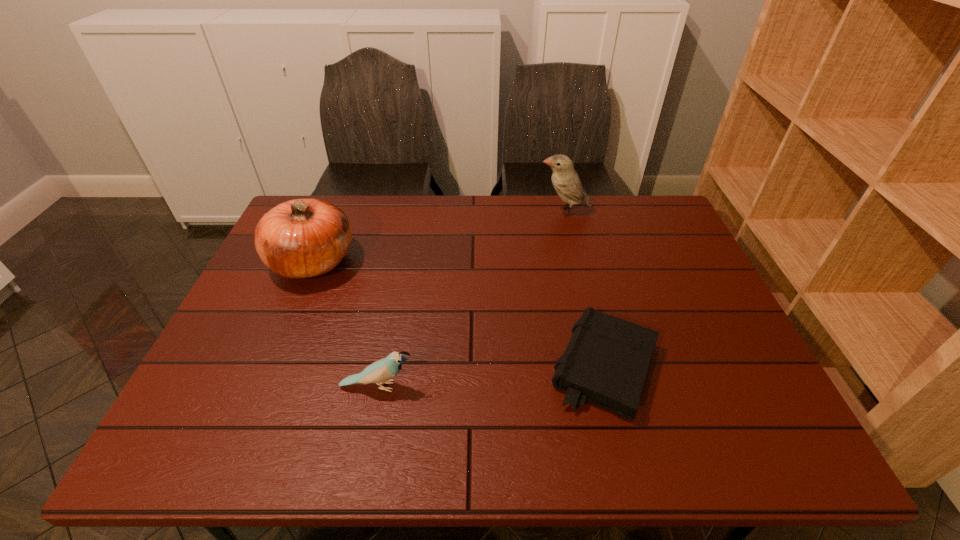
At what (x,y) coordinates should I click in order to perform the action: click on vacant space located 0.170m on the front of the third nearest object. Please return your answer as a coordinate pair (x, y). This screenshot has width=960, height=540. Looking at the image, I should click on (278, 343).

Image resolution: width=960 pixels, height=540 pixels. Identify the location of blank area located at the face of the nearer bird. tap(554, 387).

Identify the location of free space located 0.150m on the left of the shortest object. This screenshot has width=960, height=540. (483, 367).

Where is `bird at the far edge`? The image size is (960, 540). bird at the far edge is located at coordinates (565, 180).

Where is `pumpkin located at the far edge`? The image size is (960, 540). pumpkin located at the far edge is located at coordinates (301, 238).

Identify the location of object that is at the near edge. The image size is (960, 540). (605, 363).

Find the location of a particular element. The width and height of the screenshot is (960, 540). object located at the left edge is located at coordinates (301, 238).

At what (x,y) coordinates should I click in order to perform the action: click on object present at the far left corner. Please return your answer as a coordinate pair (x, y). Looking at the image, I should click on (301, 238).

Image resolution: width=960 pixels, height=540 pixels. What are the coordinates of `vacant position at the far edge of the desktop` in the screenshot? It's located at (500, 203).

In order to click on free region at the near edge of the desktop in this screenshot , I will do `click(363, 439)`.